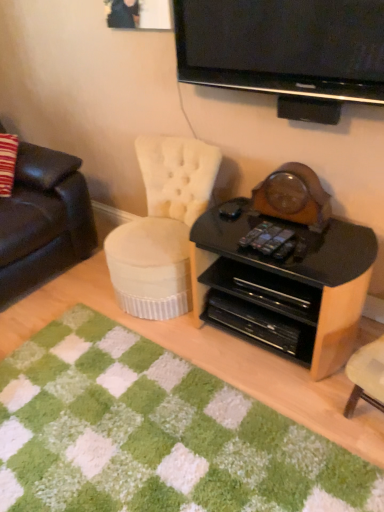
Find the location of a particular element. This screenshot has height=512, width=384. free spot to the left of black plastic remote control at center is located at coordinates (227, 238).